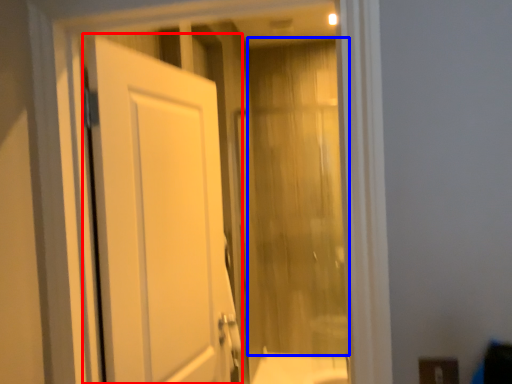
Question: Which object appears closest to the camera in this image, door (highlighted by a red box) or curtain (highlighted by a blue box)?

Choices:
 (A) door
 (B) curtain

Answer: (A)